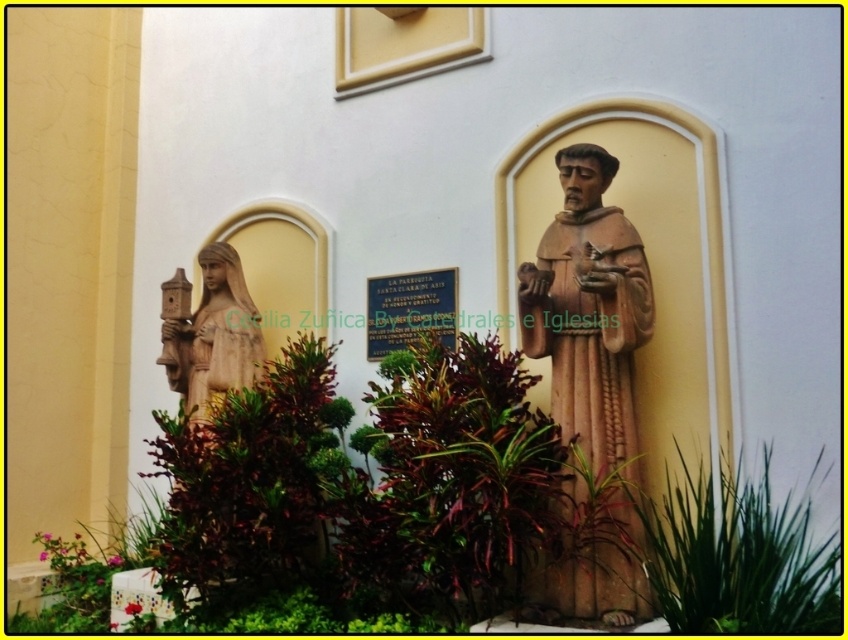
Question: From the image, what is the correct spatial relationship of matte brown statue at center in relation to wooden statue at left?

Choices:
 (A) right
 (B) left

Answer: (A)

Question: Can you confirm if matte brown statue at center is thinner than wooden statue at left?

Choices:
 (A) no
 (B) yes

Answer: (B)

Question: Which object appears closest to the camera in this image?

Choices:
 (A) wooden statue at left
 (B) matte brown statue at center

Answer: (B)

Question: Which object appears farthest from the camera in this image?

Choices:
 (A) wooden statue at left
 (B) green leafy plant at center
 (C) matte brown statue at center

Answer: (A)

Question: Considering the real-world distances, which object is farthest from the wooden statue at left?

Choices:
 (A) matte brown statue at center
 (B) green leafy plant at center

Answer: (B)

Question: Can you confirm if matte brown statue at center is smaller than wooden statue at left?

Choices:
 (A) yes
 (B) no

Answer: (B)